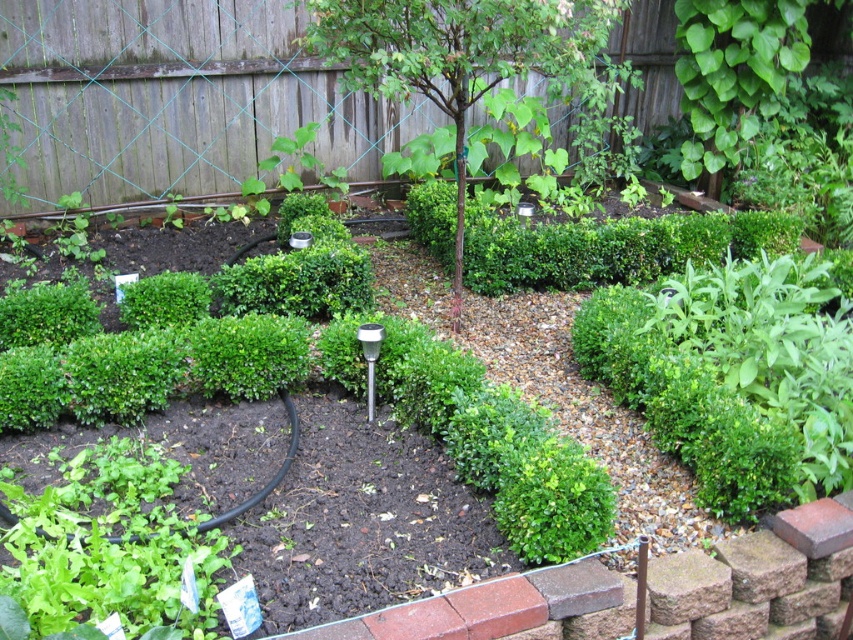
Question: Which object is farther from the camera taking this photo?

Choices:
 (A) green leafy tree at center
 (B) wooden fence at upper center

Answer: (B)

Question: Can you confirm if wooden fence at upper center is smaller than green leafy tree at center?

Choices:
 (A) yes
 (B) no

Answer: (B)

Question: Is wooden fence at upper center to the right of green leafy tree at center from the viewer's perspective?

Choices:
 (A) no
 (B) yes

Answer: (A)

Question: Which point is closer to the camera?

Choices:
 (A) green leafy tree at center
 (B) wooden fence at upper center

Answer: (A)

Question: Is wooden fence at upper center below green leafy tree at center?

Choices:
 (A) yes
 (B) no

Answer: (B)

Question: Which of the following is the closest to the observer?

Choices:
 (A) (387, 72)
 (B) (90, 97)

Answer: (A)